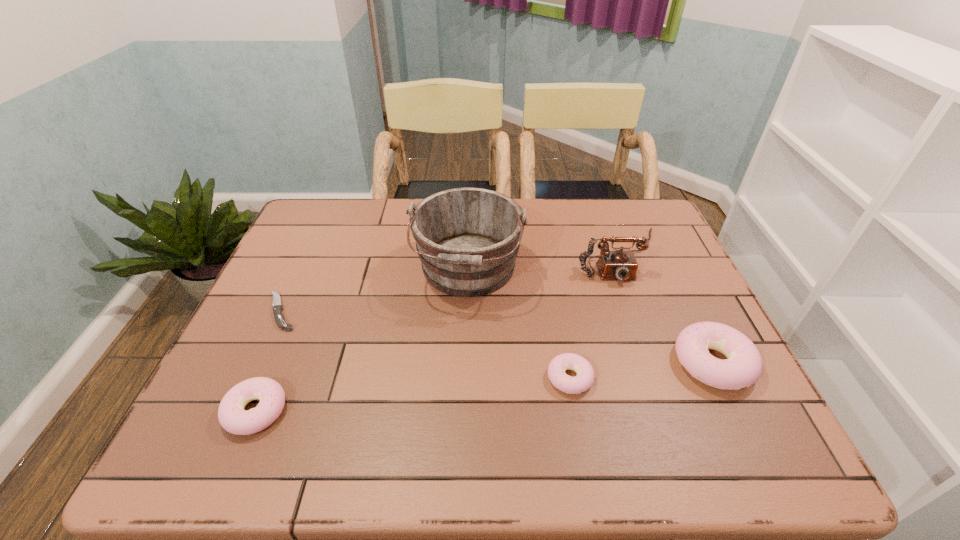
The width and height of the screenshot is (960, 540). Find the location of `the fourth tallest object`. the fourth tallest object is located at coordinates click(x=233, y=418).

Image resolution: width=960 pixels, height=540 pixels. In order to click on the leftmost doughnut in this screenshot , I will do 233,418.

At what (x,y) coordinates should I click in order to perform the action: click on the second shortest object. Please return your answer as a coordinate pair (x, y). Looking at the image, I should click on (584, 379).

At what (x,y) coordinates should I click in order to perform the action: click on the fourth object from left to right. Please return your answer as a coordinate pair (x, y). The image size is (960, 540). Looking at the image, I should click on (584, 379).

You are a GUI agent. You are given a task and a screenshot of the screen. Output one action in this format:
    pyautogui.click(x=<x>, y=<y>)
    Task: Click on the tallest doughnut
    This screenshot has height=540, width=960.
    Given the screenshot: What is the action you would take?
    pyautogui.click(x=742, y=368)

This screenshot has width=960, height=540. I want to click on the third tallest object, so click(x=742, y=368).

Where is `the third object from left to right`? This screenshot has height=540, width=960. the third object from left to right is located at coordinates (467, 239).

Identify the location of wine bucket. The height and width of the screenshot is (540, 960). (467, 239).

Image resolution: width=960 pixels, height=540 pixels. I want to click on telephone, so click(x=622, y=265).

The width and height of the screenshot is (960, 540). Find the location of `pocketknife`. pocketknife is located at coordinates (277, 307).